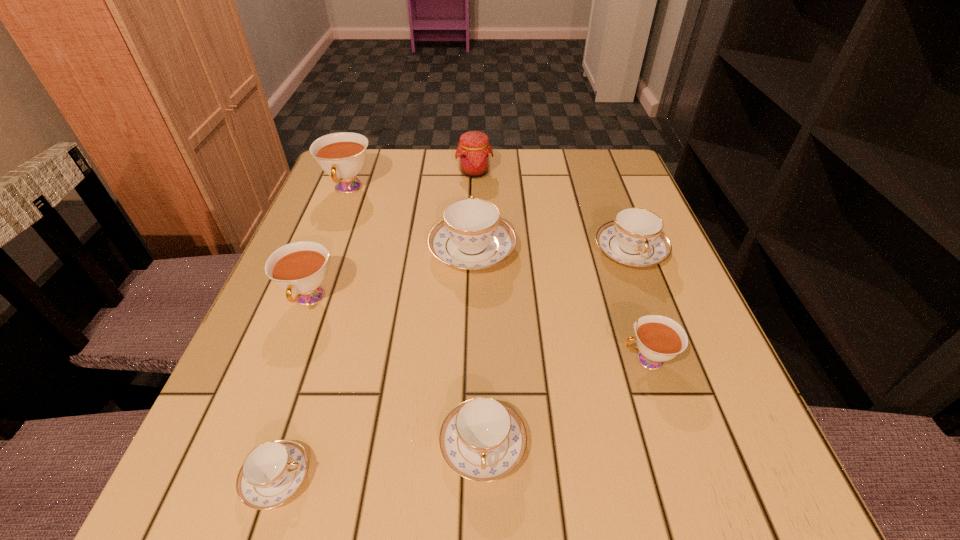
Where is `vacant space at the far right corner of the desktop`? vacant space at the far right corner of the desktop is located at coordinates (623, 158).

Find the location of a particular element. The image size is (960, 540). vacant space that is in between the tallest teacup and the leftmost blue teacup is located at coordinates (313, 333).

Identify the location of empty space between the rightmost white teacup and the rightmost blue teacup. This screenshot has width=960, height=540. (638, 306).

I want to click on vacant point located between the second smallest blue teacup and the rightmost white teacup, so click(x=564, y=402).

Locate an element on the screen. This screenshot has height=540, width=960. free space between the second farthest white teacup and the smallest blue teacup is located at coordinates (293, 388).

Find the location of a particular element. The height and width of the screenshot is (540, 960). free spot between the shortest object and the third smallest blue teacup is located at coordinates (453, 364).

Where is `unoccupied position between the biggest blue teacup and the third biggest blue teacup`? The width and height of the screenshot is (960, 540). unoccupied position between the biggest blue teacup and the third biggest blue teacup is located at coordinates (478, 347).

Image resolution: width=960 pixels, height=540 pixels. What are the coordinates of `empty location between the second smallest blue teacup and the leftmost blue teacup` in the screenshot? It's located at (380, 461).

At what (x,y) coordinates should I click in order to perform the action: click on vacant area that lies between the farthest teacup and the biggest blue teacup. Please return your answer as a coordinate pair (x, y). This screenshot has width=960, height=540. Looking at the image, I should click on (410, 220).

Locate an element on the screen. This screenshot has height=540, width=960. vacant area that lies between the biggest white teacup and the red jam is located at coordinates (411, 181).